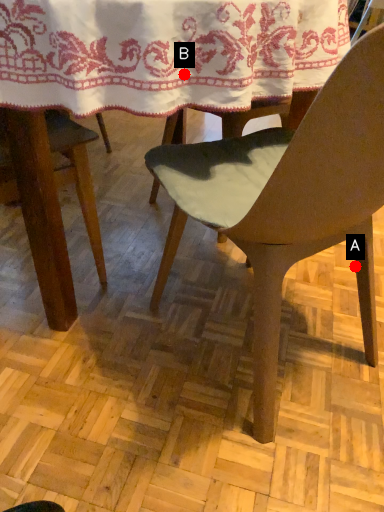
Question: Two points are circled on the image, labeled by A and B beside each circle. Which point is closer to the camera?

Choices:
 (A) A is closer
 (B) B is closer

Answer: (B)